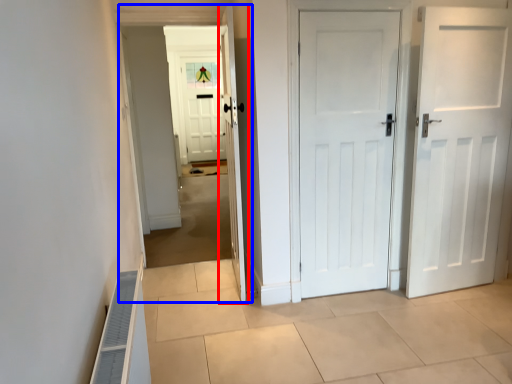
Question: Among these objects, which one is farthest to the camera, door (highlighted by a red box) or corridor (highlighted by a blue box)?

Choices:
 (A) door
 (B) corridor

Answer: (B)